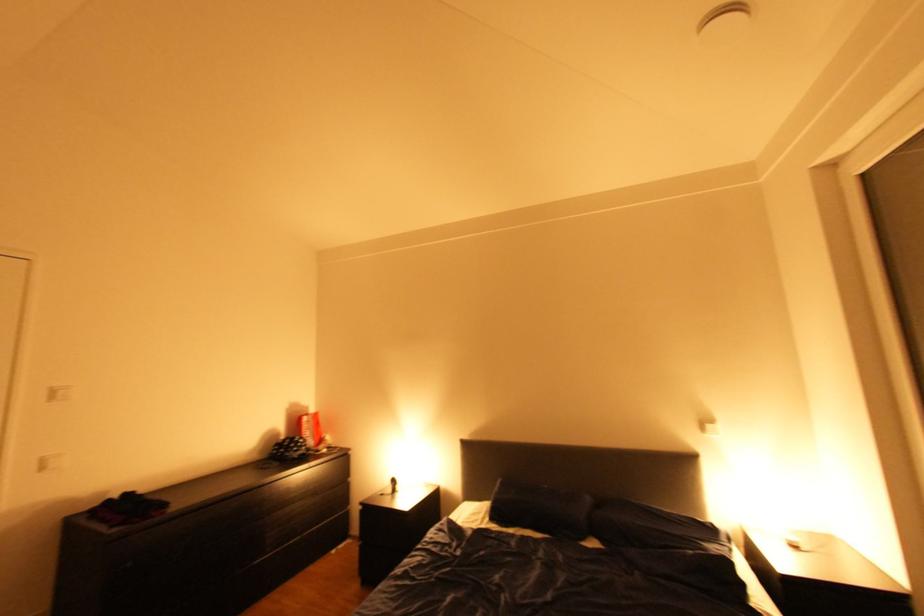
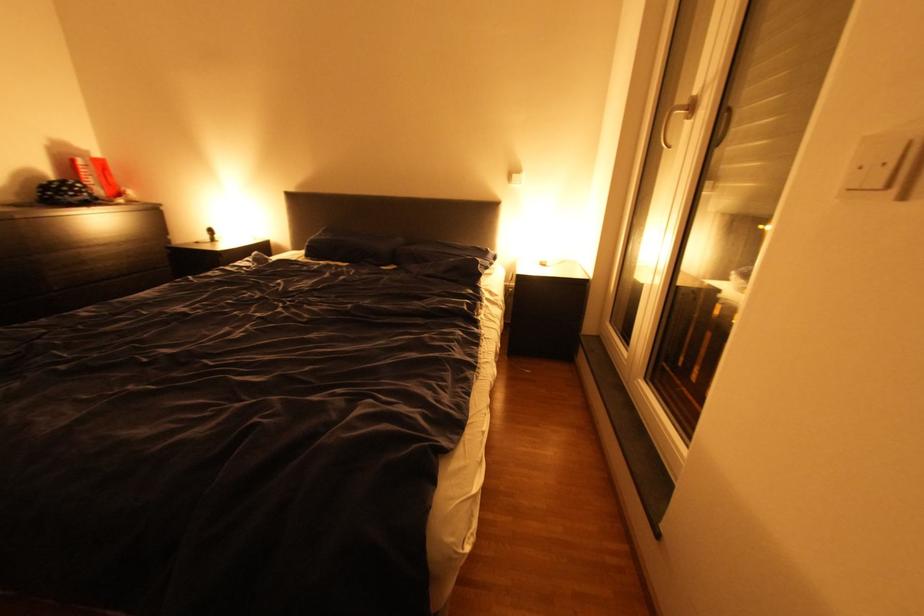
How did the camera likely rotate?

The camera's rotation is toward right-down.